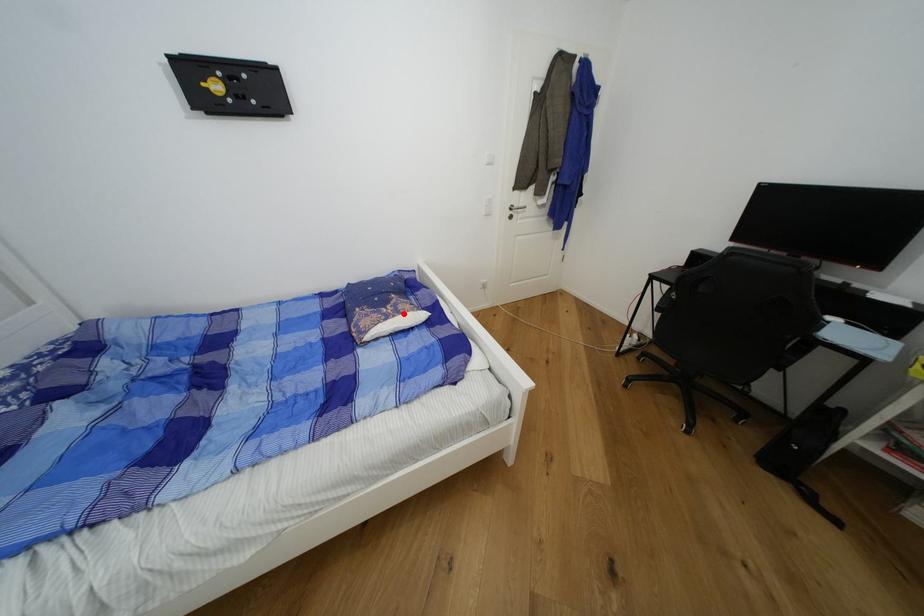
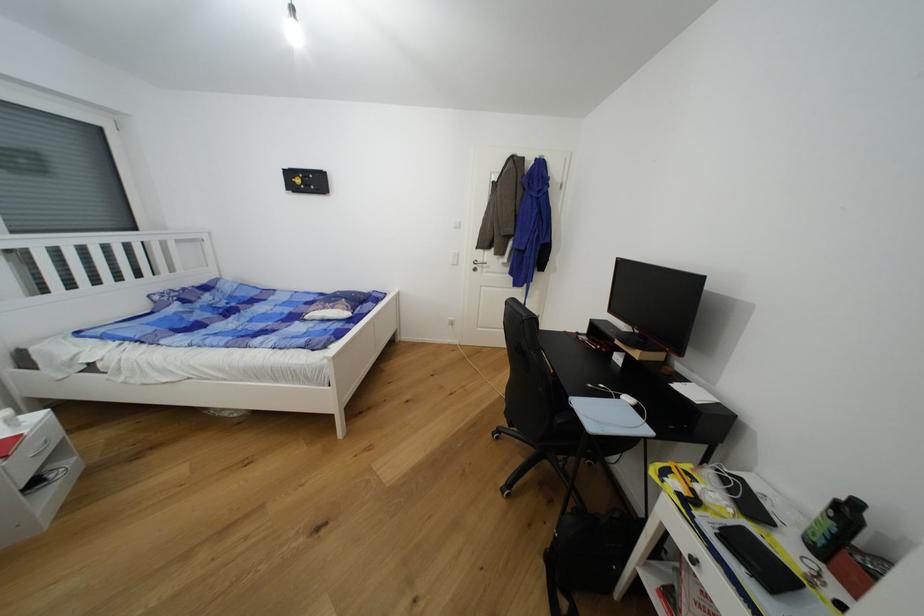
In the second image, find the point that corresponds to the highlighted location in the first image.

(337, 310)